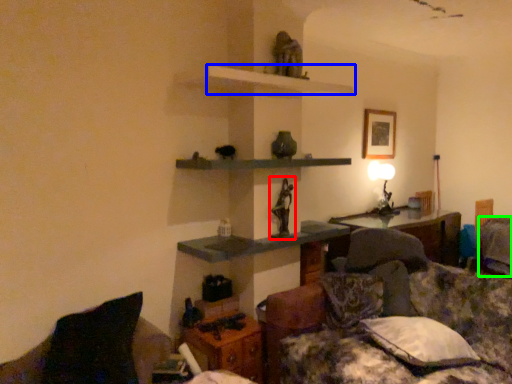
Question: Estimate the real-world distances between objects in this image. Which object is farther from sculpture (highlighted by a red box), shelf (highlighted by a blue box) or pillow (highlighted by a green box)?

Choices:
 (A) shelf
 (B) pillow

Answer: (B)